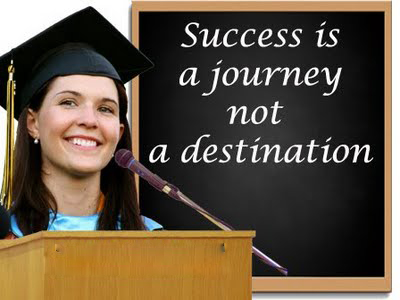
Locate an element on the screen. The width and height of the screenshot is (400, 300). dark gray rectangular chalkboard is located at coordinates (144, 18).